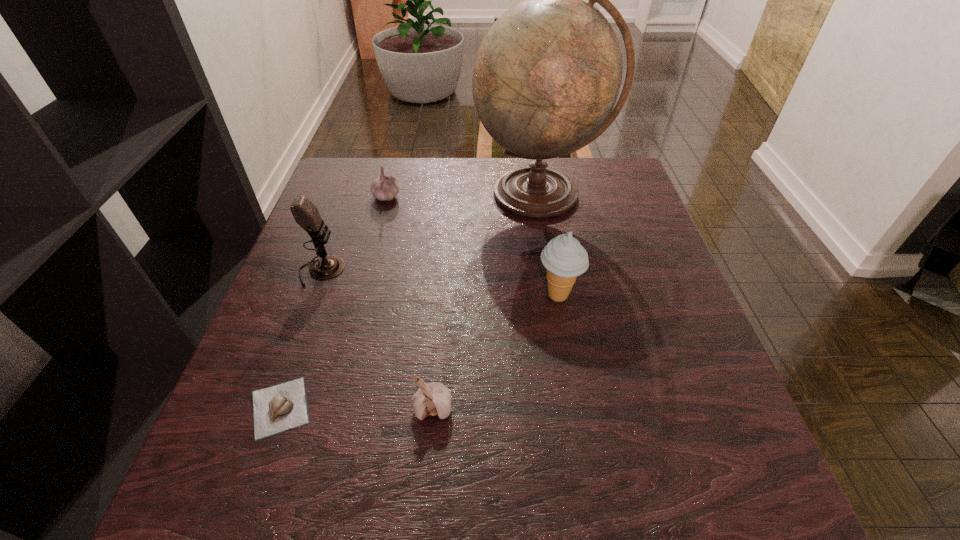
Identify the location of free space at the right edge of the desktop. The width and height of the screenshot is (960, 540). (592, 232).

The height and width of the screenshot is (540, 960). Identify the location of free space at the far left corner. (359, 186).

Identify the location of free region at the near left corner of the desktop. (292, 465).

Where is `vacant position at the far right corner of the desktop`? Image resolution: width=960 pixels, height=540 pixels. vacant position at the far right corner of the desktop is located at coordinates (580, 195).

In the image, there is a desktop. Where is `vacant area at the near right corner`? The width and height of the screenshot is (960, 540). vacant area at the near right corner is located at coordinates (716, 503).

Find the location of a particular element. The width and height of the screenshot is (960, 540). vacant area between the shortest garlic and the farthest garlic is located at coordinates (333, 302).

I want to click on empty space that is in between the fourth object from left to right and the icecream, so click(x=495, y=352).

Identify the location of vacant area that lies between the microphone and the third object from right to left. The width and height of the screenshot is (960, 540). (376, 339).

Where is `vacant space that's between the fourth object from left to right and the farthest garlic`? This screenshot has height=540, width=960. vacant space that's between the fourth object from left to right and the farthest garlic is located at coordinates (409, 302).

Where is `empty space that is in between the rightmost garlic and the icecream`? The height and width of the screenshot is (540, 960). empty space that is in between the rightmost garlic and the icecream is located at coordinates (495, 352).